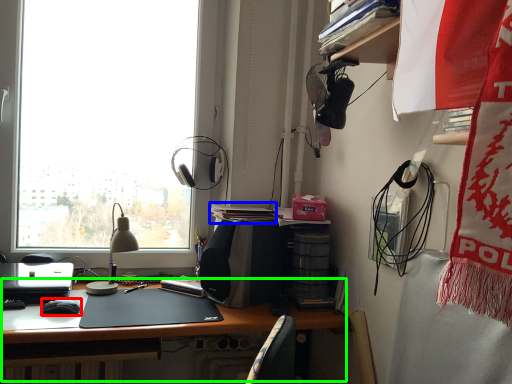
Question: Which object is the farthest from mouse (highlighted by a red box)? Choose among these: book (highlighted by a blue box) or desk (highlighted by a green box).

Choices:
 (A) book
 (B) desk

Answer: (A)